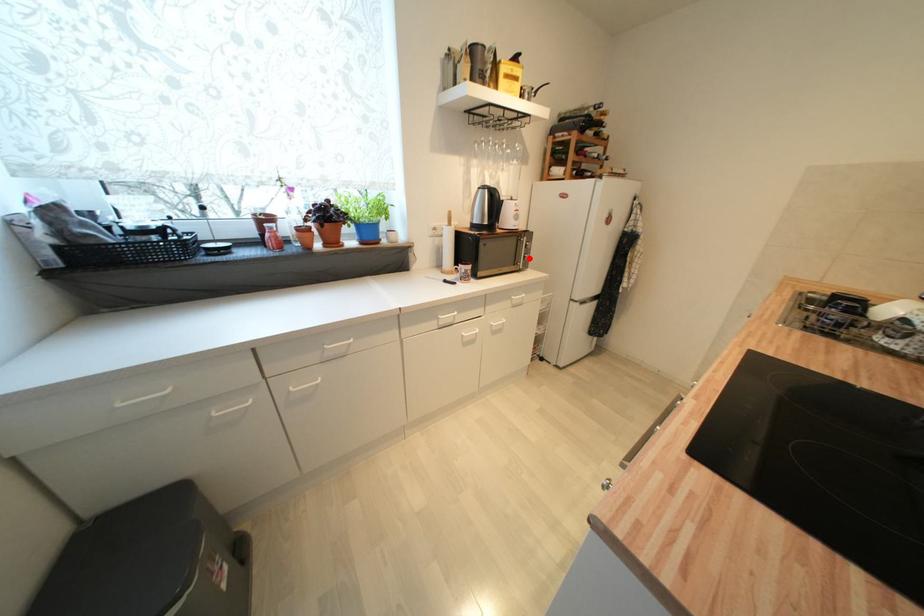
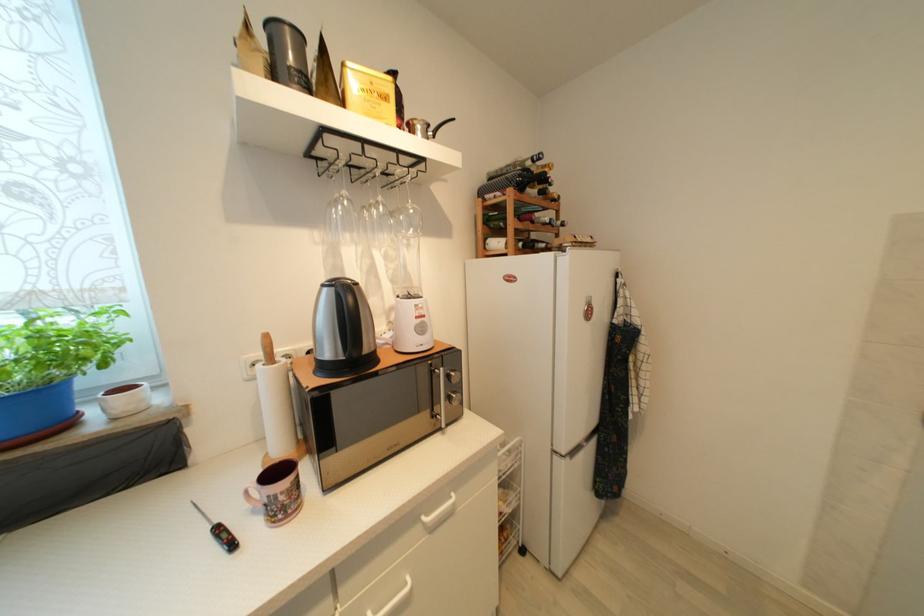
The point at the highlighted location is marked in the first image. Where is the corresponding point in the second image?

(455, 400)